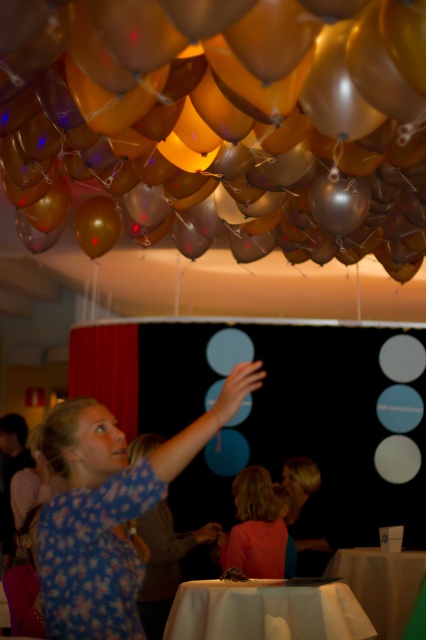
Is floral fabric shirt at center below orange fabric child at lower center?

No, floral fabric shirt at center is not below orange fabric child at lower center.

Which is behind, point (244, 388) or point (267, 477)?

Positioned behind is point (267, 477).

Does point (69, 557) come behind point (252, 572)?

That is False.

Locate an element on the screen. floral fabric shirt at center is located at coordinates (111, 512).

Who is positioned more to the left, translucent metallic balloon at upper center or floral fabric shirt at center?

floral fabric shirt at center is more to the left.

Based on the photo, can you confirm if translucent metallic balloon at upper center is thinner than floral fabric shirt at center?

No, translucent metallic balloon at upper center is not thinner than floral fabric shirt at center.

Which is in front, point (279, 132) or point (245, 376)?

Positioned in front is point (245, 376).

This screenshot has height=640, width=426. I want to click on translucent metallic balloon at upper center, so click(x=221, y=120).

Which is above, floral fabric shirt at center or smooth beige table at lower center?

floral fabric shirt at center

Can you confirm if floral fabric shirt at center is positioned to the left of smooth beige table at lower center?

Indeed, floral fabric shirt at center is positioned on the left side of smooth beige table at lower center.

This screenshot has height=640, width=426. What do you see at coordinates (111, 512) in the screenshot? I see `floral fabric shirt at center` at bounding box center [111, 512].

This screenshot has width=426, height=640. In order to click on floral fabric shirt at center in this screenshot , I will do 111,512.